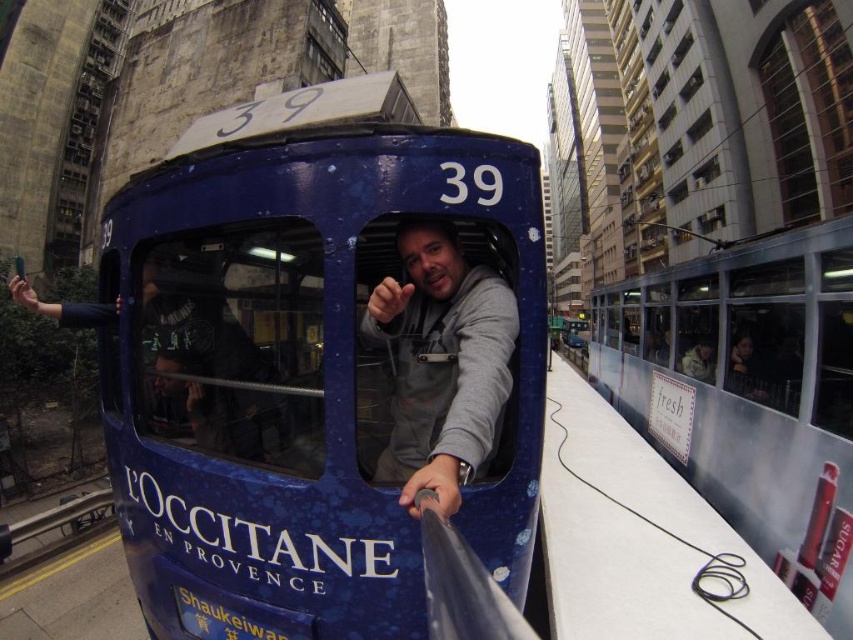
Is metallic silver tram at right to the left of gray fabric at center from the viewer's perspective?

No, metallic silver tram at right is not to the left of gray fabric at center.

Can you confirm if metallic silver tram at right is positioned above gray fabric at center?

No, metallic silver tram at right is not above gray fabric at center.

This screenshot has width=853, height=640. Find the location of `metallic silver tram at right`. metallic silver tram at right is located at coordinates (749, 394).

This screenshot has width=853, height=640. Identify the location of metallic silver tram at right. coord(749,394).